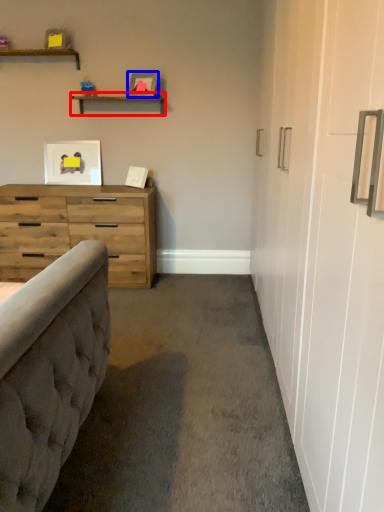
Question: Among these objects, which one is nearest to the camera, shelf (highlighted by a red box) or picture frame (highlighted by a blue box)?

Choices:
 (A) shelf
 (B) picture frame

Answer: (B)